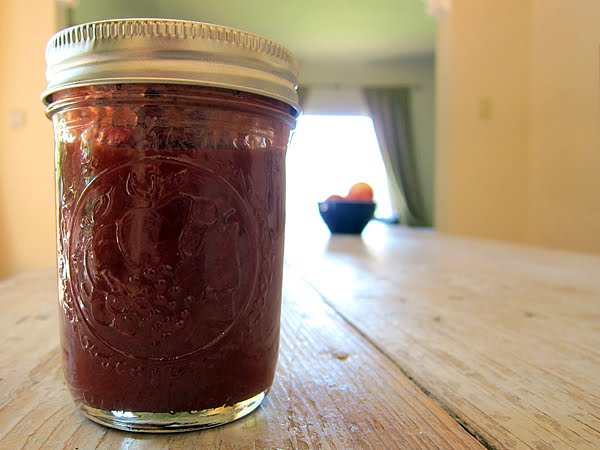
The height and width of the screenshot is (450, 600). What are the coordinates of `glass` in the screenshot? It's located at (223, 220).